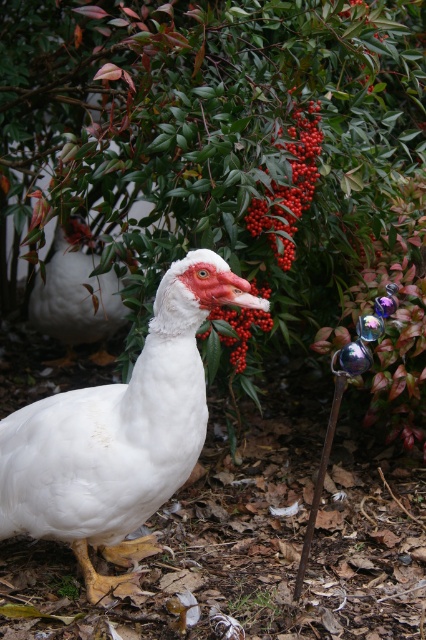
Question: Does green leafy bush at center lie in front of shiny red berries at center?

Choices:
 (A) yes
 (B) no

Answer: (A)

Question: Observing the image, what is the correct spatial positioning of white feathered duck at center in reference to white matte duck at center?

Choices:
 (A) right
 (B) left

Answer: (A)

Question: Which object is farther from the camera taking this photo?

Choices:
 (A) white matte duck at center
 (B) white feathered duck at center
 (C) white matte duckbill at center
 (D) shiny red berries at center

Answer: (A)

Question: Is shiny red berries at center further to camera compared to red matte berry at center?

Choices:
 (A) yes
 (B) no

Answer: (B)

Question: Which point is closer to the camera?

Choices:
 (A) (236, 352)
 (B) (23, 467)

Answer: (B)

Question: Among these points, which one is farthest from the camera?

Choices:
 (A) (282, 209)
 (B) (222, 272)
 (C) (204, 262)

Answer: (A)